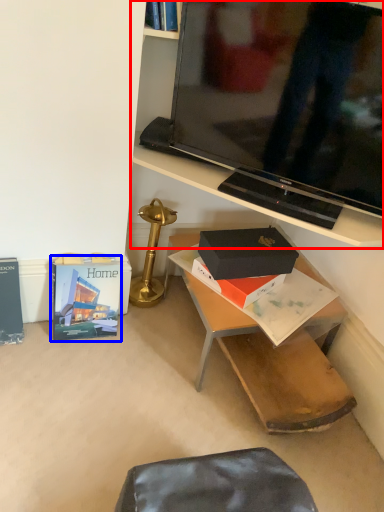
Question: Among these objects, which one is nearest to the camera, shelf (highlighted by a red box) or paperback book (highlighted by a blue box)?

Choices:
 (A) shelf
 (B) paperback book

Answer: (A)